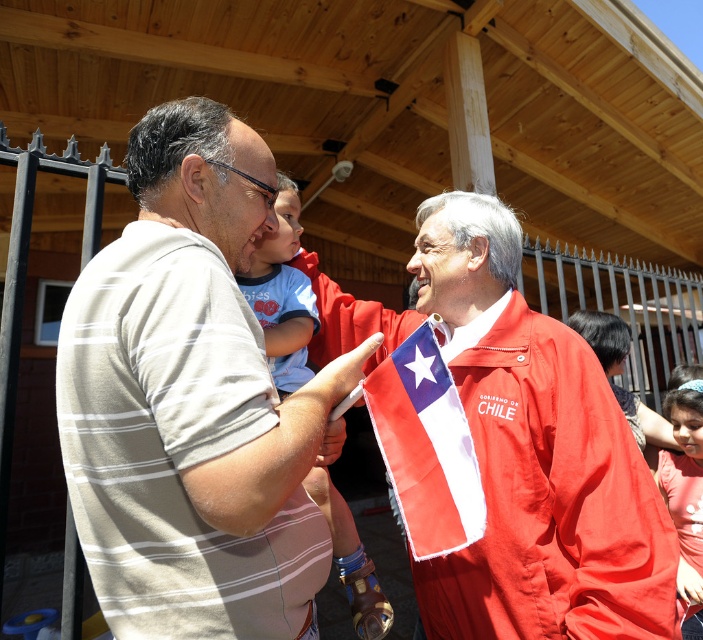
Is point (496, 609) positioned before point (389, 474)?

No, it is behind (389, 474).

Who is higher up, red matte jacket at center or red fabric flag at center?

red matte jacket at center

Between point (477, 570) and point (425, 465), which one is positioned in front?

Positioned in front is point (425, 465).

Where is `red matte jacket at center`? The width and height of the screenshot is (703, 640). red matte jacket at center is located at coordinates (535, 456).

Is striped cotton shirt at left to the right of red matte jacket at center from the viewer's perspective?

No, striped cotton shirt at left is not to the right of red matte jacket at center.

Between striped cotton shirt at left and red matte jacket at center, which one is positioned higher?

striped cotton shirt at left is above.

Where is `striped cotton shirt at left`? striped cotton shirt at left is located at coordinates (193, 401).

Does red fabric flag at center have a greater height compared to matte pink shirt at lower right?

No, red fabric flag at center is not taller than matte pink shirt at lower right.

Is red fabric flag at center to the left of matte pink shirt at lower right from the viewer's perspective?

Indeed, red fabric flag at center is positioned on the left side of matte pink shirt at lower right.

Find the location of `red fabric flag at center`. red fabric flag at center is located at coordinates (425, 445).

Image resolution: width=703 pixels, height=640 pixels. Identify the location of red fabric flag at center. (425, 445).